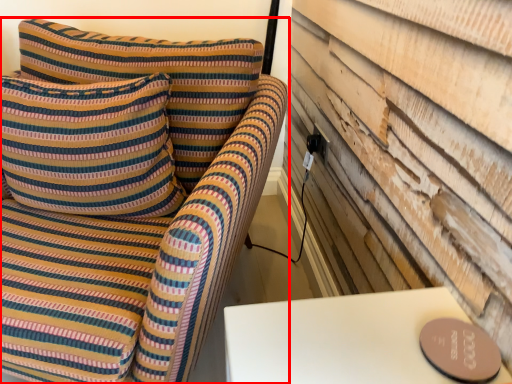
Question: Observing the image, what is the correct spatial positioning of furniture (annotated by the red box) in reference to pillow?

Choices:
 (A) right
 (B) left

Answer: (A)